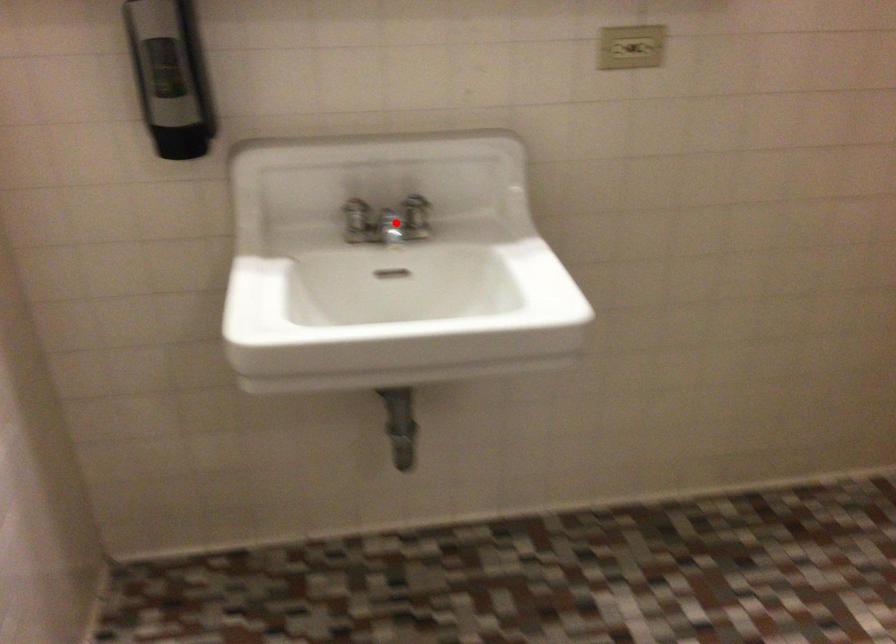
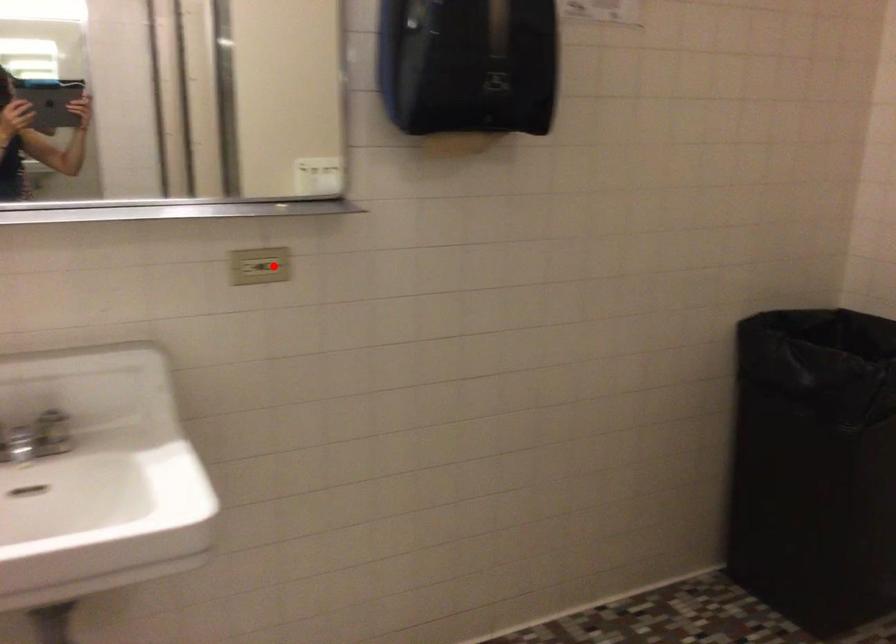
I am providing you with two images of the same scene from different viewpoints. A red point is marked on the first image and another point is marked on the second image. Is the marked point in image1 the same physical position as the marked point in image2?

No